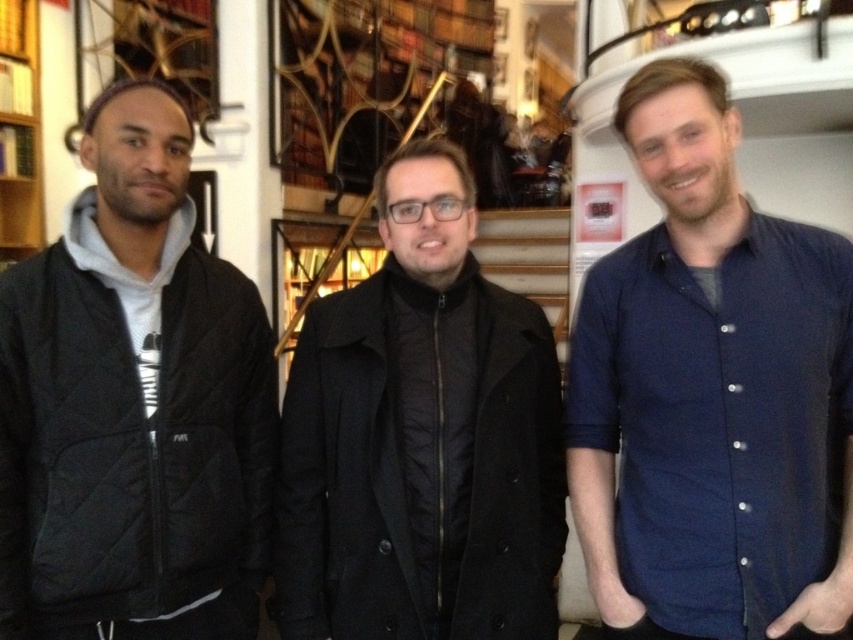
Question: Can you confirm if black quilted jacket at center is wider than wooden bookshelf at left?

Choices:
 (A) no
 (B) yes

Answer: (B)

Question: Which object appears farthest from the camera in this image?

Choices:
 (A) black quilted jacket at center
 (B) black quilted jacket at left

Answer: (A)

Question: Is blue cotton shirt at right to the left of wooden bookshelf at left from the viewer's perspective?

Choices:
 (A) yes
 (B) no

Answer: (B)

Question: Which is farther from the wooden bookshelf at left?

Choices:
 (A) black quilted jacket at left
 (B) black quilted jacket at center

Answer: (B)

Question: Which of the following is the closest to the observer?

Choices:
 (A) wooden bookshelf at left
 (B) blue cotton shirt at right
 (C) black quilted jacket at left

Answer: (B)

Question: Is blue cotton shirt at right in front of wooden bookshelf at left?

Choices:
 (A) yes
 (B) no

Answer: (A)